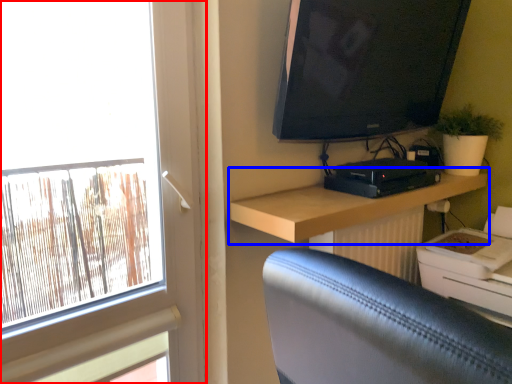
Question: Which of the following is the closest to the observer, window (highlighted by a red box) or shelf (highlighted by a blue box)?

Choices:
 (A) window
 (B) shelf

Answer: (A)